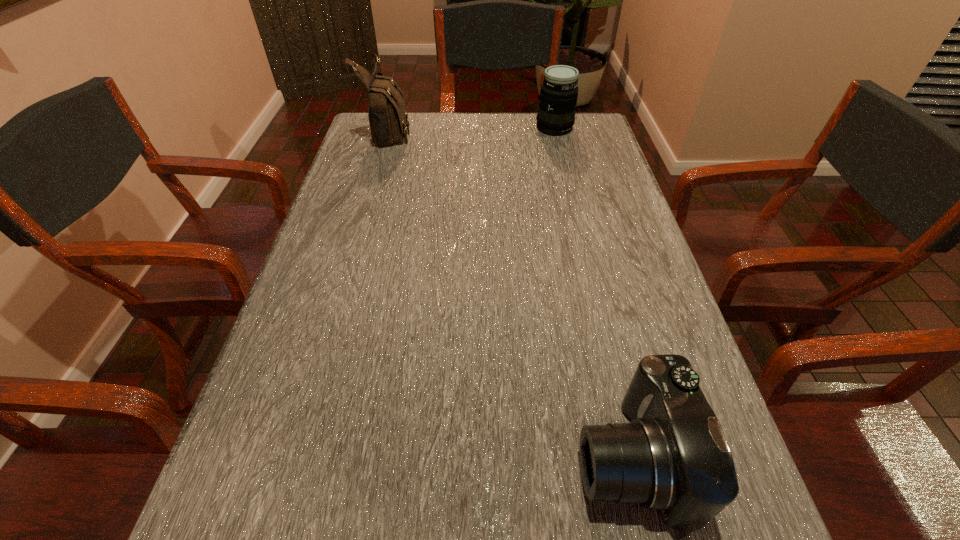
I want to click on empty location between the leftmost object and the second tallest object, so click(471, 130).

Find the location of a particular element. The height and width of the screenshot is (540, 960). vacant space in between the leftmost object and the nearest object is located at coordinates (510, 294).

Choose which object is the nearest neighbor to the second shortest object. Please provide its 2D coordinates. Your answer should be formatted as a tuple, i.e. [(x, y)], where the tuple contains the x and y coordinates of a point satisfying the conditions above.

[(388, 118)]

I want to click on the closest object to the telephoto lens, so (388, 118).